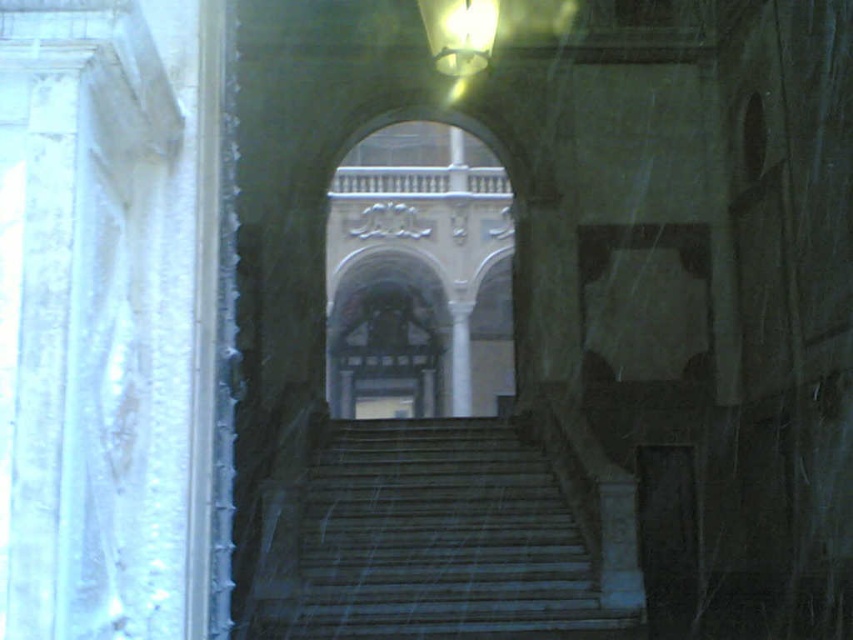
Question: Is white marble archway at center bigger than white marble column at center?

Choices:
 (A) no
 (B) yes

Answer: (B)

Question: Observing the image, what is the correct spatial positioning of white marble archway at center in reference to white marble column at center?

Choices:
 (A) below
 (B) above

Answer: (B)

Question: Which point is closer to the camera?

Choices:
 (A) (456, 323)
 (B) (379, 253)
 (C) (369, 525)

Answer: (C)

Question: Which of the following is the farthest from the observer?

Choices:
 (A) white marble column at center
 (B) white marble archway at center
 (C) dark gray stone stairs at center

Answer: (A)

Question: Is white marble archway at center in front of white marble column at center?

Choices:
 (A) no
 (B) yes

Answer: (B)

Question: Which object is the closest to the white marble archway at center?

Choices:
 (A) white marble column at center
 (B) dark gray stone stairs at center

Answer: (A)